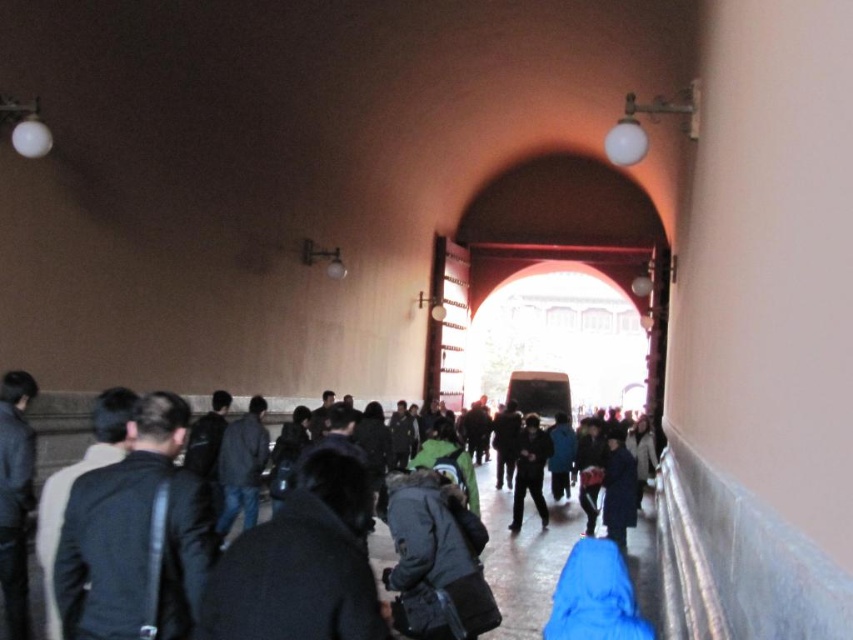
Question: Does black fabric jacket at left appear on the right side of dark gray coat at center?

Choices:
 (A) yes
 (B) no

Answer: (B)

Question: Can you confirm if black fabric jacket at left is positioned to the right of dark gray jacket at center?

Choices:
 (A) yes
 (B) no

Answer: (B)

Question: Which is farther from the dark gray coat at center?

Choices:
 (A) black fabric jacket at left
 (B) dark gray jacket at center

Answer: (A)

Question: Among these objects, which one is farthest from the camera?

Choices:
 (A) dark gray jacket at center
 (B) dark gray coat at center
 (C) black fabric jacket at left

Answer: (A)

Question: Observing the image, what is the correct spatial positioning of dark gray coat at center in reference to dark gray jacket at center?

Choices:
 (A) below
 (B) above

Answer: (A)

Question: Which point is farther to the camera?

Choices:
 (A) (535, 506)
 (B) (173, 628)

Answer: (A)